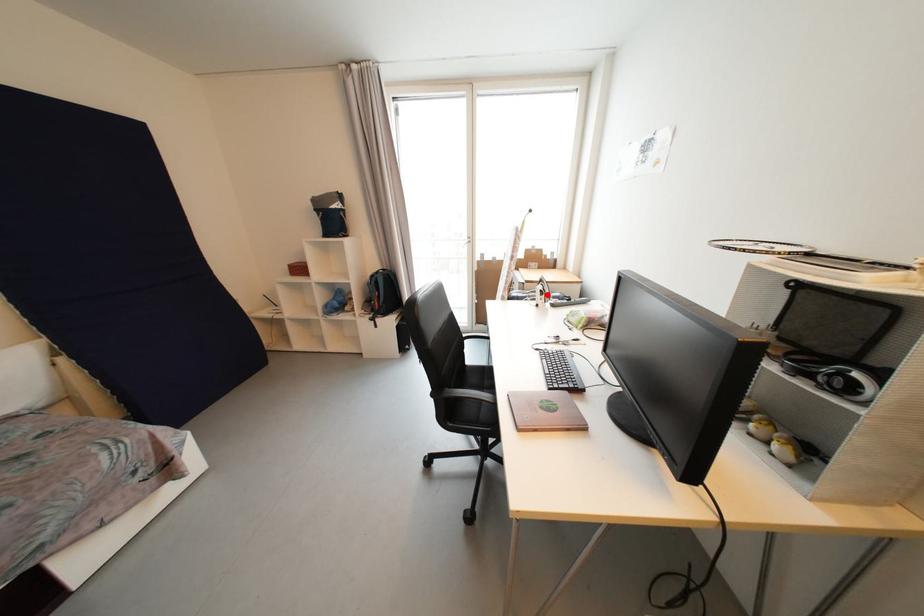
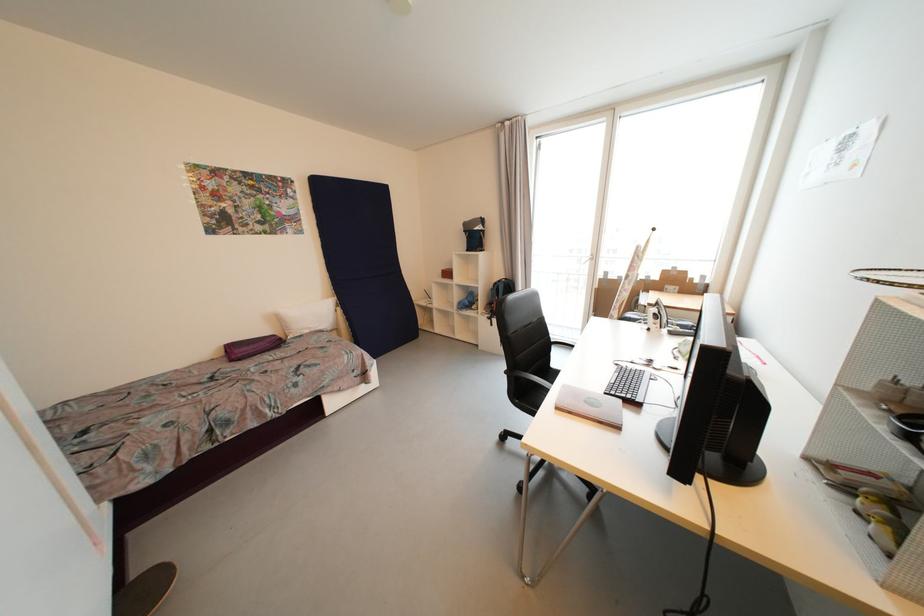
Where in the second image is the point corresponding to the highlighted location from the first image?

(662, 318)